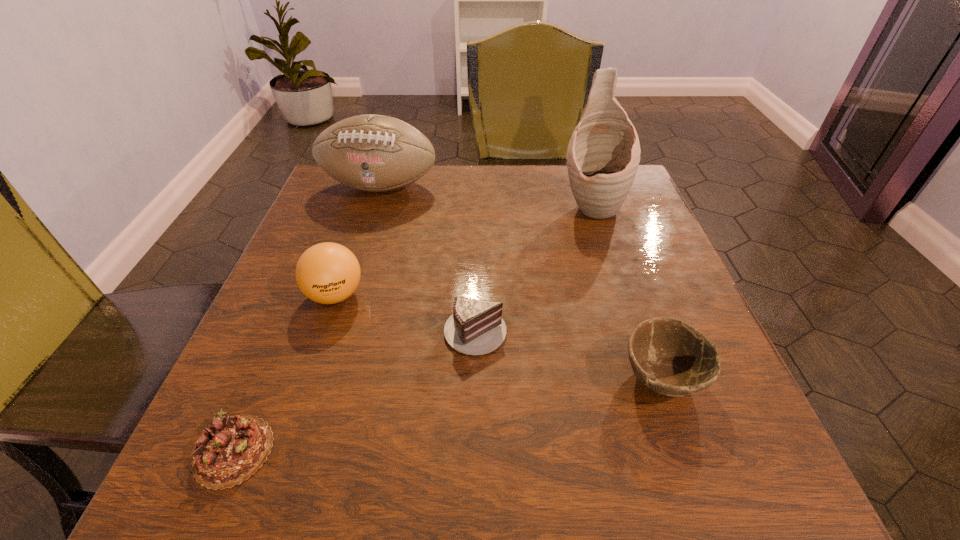
This screenshot has width=960, height=540. Identify the location of vacant space at the near right corner of the desktop. (758, 475).

Locate an element on the screen. This screenshot has height=540, width=960. empty space that is in between the ping-pong ball and the taller chocolate cake is located at coordinates (405, 312).

The height and width of the screenshot is (540, 960). In order to click on vacant region between the left chocolate cake and the ping-pong ball in this screenshot , I will do `click(284, 373)`.

This screenshot has height=540, width=960. Identify the location of empty location between the bowl and the right chocolate cake. (568, 353).

Find the location of `free spot between the bowl and the left chocolate cake`. free spot between the bowl and the left chocolate cake is located at coordinates (447, 414).

Where is `free space between the football (American) and the tallest object`? This screenshot has height=540, width=960. free space between the football (American) and the tallest object is located at coordinates (486, 197).

Where is `empty space that is in between the third tallest object and the taller chocolate cake`? The width and height of the screenshot is (960, 540). empty space that is in between the third tallest object and the taller chocolate cake is located at coordinates (405, 312).

Identify the location of unoccupied area between the ping-pong ball and the farther chocolate cake. (405, 312).

Where is `blank region between the second tallest object and the pitcher`? blank region between the second tallest object and the pitcher is located at coordinates (486, 197).

Where is `free space between the nearer chocolate cake and the fourth shortest object`? The height and width of the screenshot is (540, 960). free space between the nearer chocolate cake and the fourth shortest object is located at coordinates (284, 373).